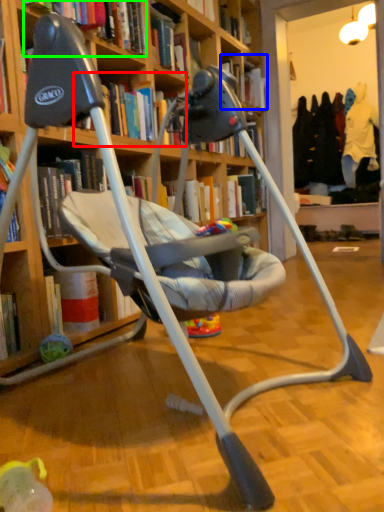
Question: Based on their relative distances, which object is farther from book (highlighted by a red box)? Choose from book (highlighted by a blue box) and book (highlighted by a green box).

Choices:
 (A) book
 (B) book

Answer: (A)